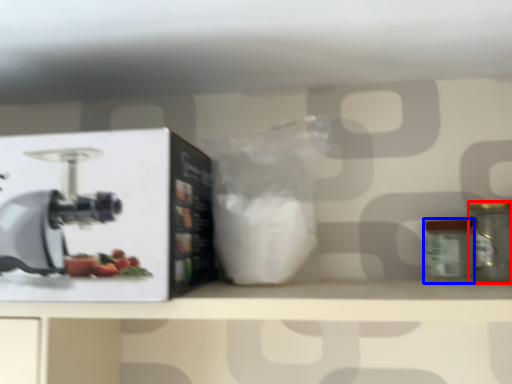
Question: Among these objects, which one is nearest to the camera, kitchen appliance (highlighted by a red box) or glass jar (highlighted by a blue box)?

Choices:
 (A) kitchen appliance
 (B) glass jar

Answer: (A)